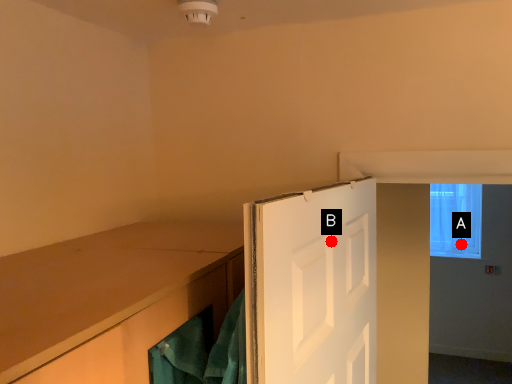
Question: Two points are circled on the image, labeled by A and B beside each circle. Which point appears farthest from the camera in this image?

Choices:
 (A) A is further
 (B) B is further

Answer: (A)